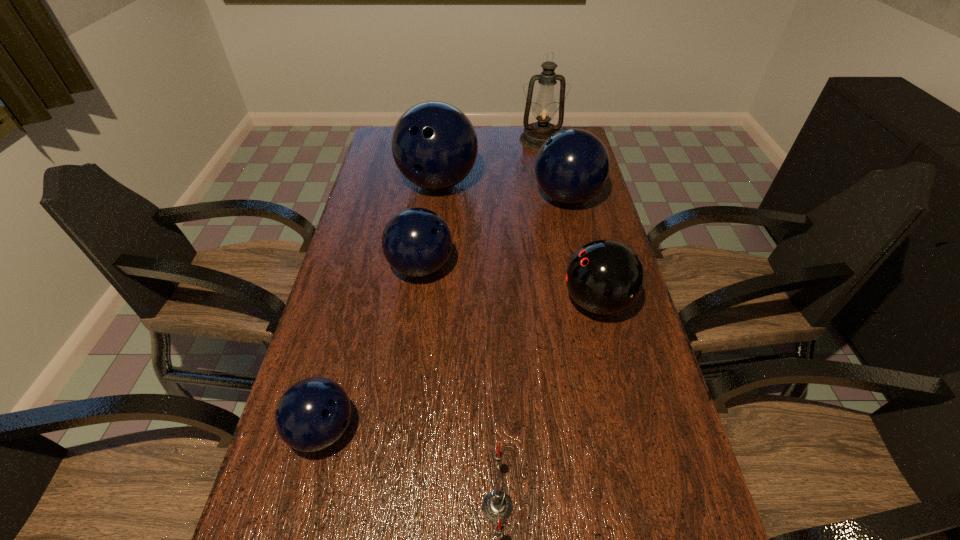
The height and width of the screenshot is (540, 960). In order to click on oil lamp that is at the right edge in this screenshot , I will do click(544, 110).

Locate an element on the screen. object that is at the far right corner is located at coordinates (544, 110).

You are a GUI agent. You are given a task and a screenshot of the screen. Output one action in this format:
    pyautogui.click(x=<x>, y=<y>)
    Task: Click on the blank space at the far edge of the desktop
    The width and height of the screenshot is (960, 540).
    Given the screenshot: What is the action you would take?
    pyautogui.click(x=517, y=134)

Where is `free space at the left edge of the desktop`? This screenshot has height=540, width=960. free space at the left edge of the desktop is located at coordinates (389, 168).

I want to click on free space between the shortest bowling ball and the black bowling ball, so click(x=460, y=366).

Find the location of a particular element. The image size is (960, 540). empty location between the black bowling ball and the sixth shortest object is located at coordinates (517, 242).

Where is `free space between the black bowling ball and the oil lamp`? Image resolution: width=960 pixels, height=540 pixels. free space between the black bowling ball and the oil lamp is located at coordinates (569, 221).

Locate which object ranks second in proximity to the second smallest blue bowling ball. Please provide its 2D coordinates. Your answer should be formatted as a tuple, i.e. [(x, y)], where the tuple contains the x and y coordinates of a point satisfying the conditions above.

[(572, 166)]

Select which object is the sixth closest to the nearest blue bowling ball. Please provide its 2D coordinates. Your answer should be formatted as a tuple, i.e. [(x, y)], where the tuple contains the x and y coordinates of a point satisfying the conditions above.

[(544, 110)]

Select which bowling ball is the fourth closest to the black bowling ball. Please provide its 2D coordinates. Your answer should be formatted as a tuple, i.e. [(x, y)], where the tuple contains the x and y coordinates of a point satisfying the conditions above.

[(314, 413)]